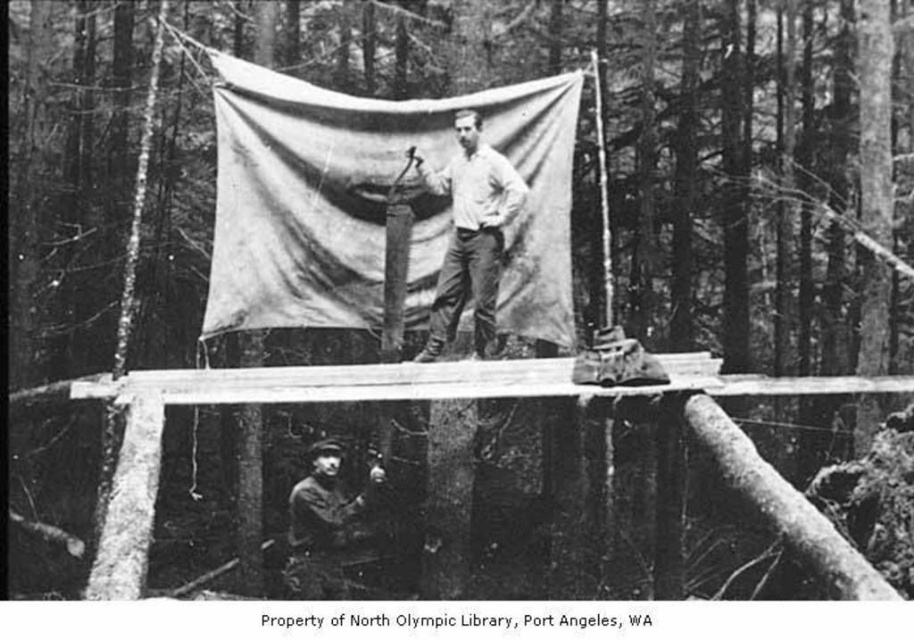
Question: Which point is farther to the camera?

Choices:
 (A) (540, 148)
 (B) (468, 240)
 (C) (320, 541)

Answer: (A)

Question: Which point appears farthest from the camera in this image?

Choices:
 (A) (541, 273)
 (B) (505, 381)

Answer: (A)

Question: Which object appears closest to the camera in this image?

Choices:
 (A) matte canvas tarp at center
 (B) smooth white shirt at center

Answer: (B)

Question: Can you confirm if matte canvas tarp at center is thinner than rugged leather jacket at lower center?

Choices:
 (A) yes
 (B) no

Answer: (B)

Question: Is matte canvas tarp at center to the left of smooth white shirt at center from the viewer's perspective?

Choices:
 (A) yes
 (B) no

Answer: (A)

Question: Is matte canvas tarp at center to the right of smooth wood at lower left from the viewer's perspective?

Choices:
 (A) no
 (B) yes

Answer: (B)